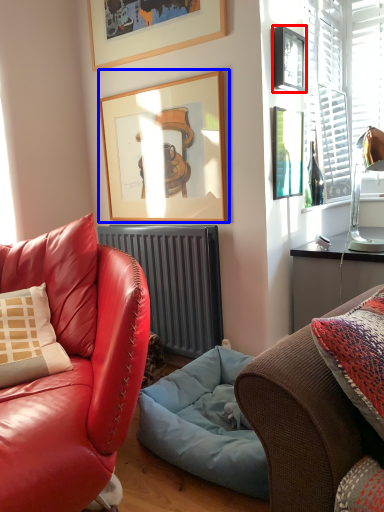
Question: Which object appears closest to the camera in this image, picture frame (highlighted by a red box) or picture frame (highlighted by a blue box)?

Choices:
 (A) picture frame
 (B) picture frame

Answer: (A)